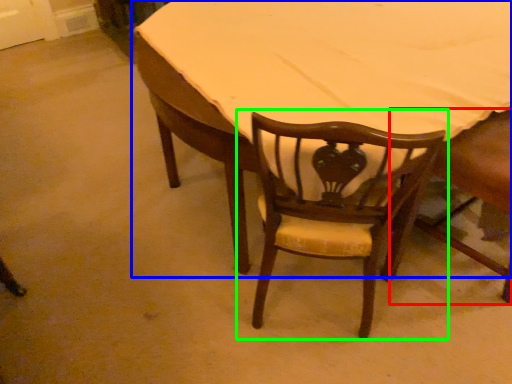
Question: Which object is positioned closest to chair (highlighted by a red box)? Select from table (highlighted by a blue box) and chair (highlighted by a green box).

Choices:
 (A) table
 (B) chair

Answer: (B)